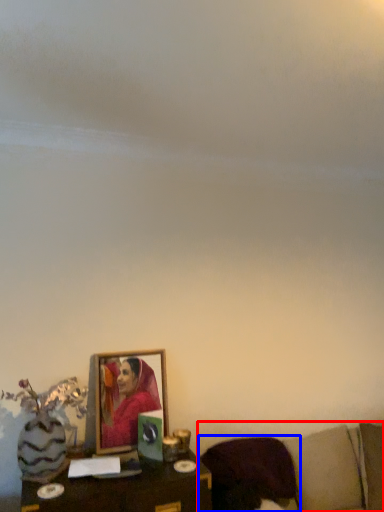
Question: Which object appears farthest to the camera in this image, furniture (highlighted by a red box) or pillow (highlighted by a blue box)?

Choices:
 (A) furniture
 (B) pillow

Answer: (B)